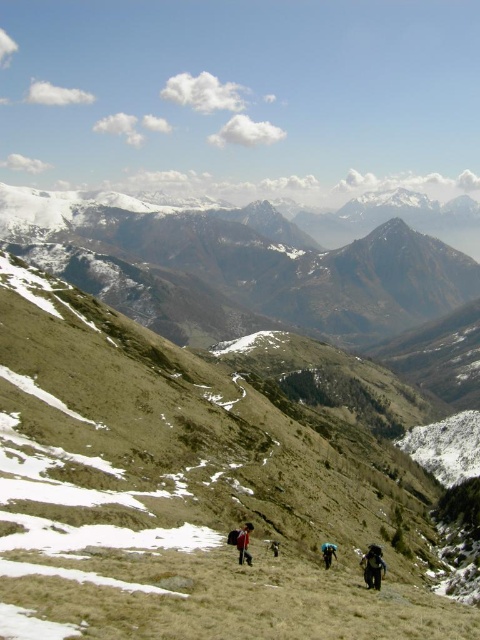
You are a hiker standing at the bottom of the slope looking up. You see the green grassy hillside at center and the dark blue fabric backpack at center. Which object is positioned to the left when viewed from your perspective?

The green grassy hillside at center is to the left of the dark blue fabric backpack at center from your perspective.

You are a hiker who wants to choose a backpack with more storage space. You see a camouflage fabric backpack at center and a blue fabric backpack at center. Which backpack should you choose based on their sizes?

The blue fabric backpack at center is taller than the camouflage fabric backpack at center, so it likely has more storage space.

You are a hiker planning to climb the mountain. You see the green grassy hillside at center and the dark blue fabric backpack at center. Which one is higher up the slope?

The green grassy hillside at center is located above the dark blue fabric backpack at center, so the green grassy hillside at center is higher up the slope.